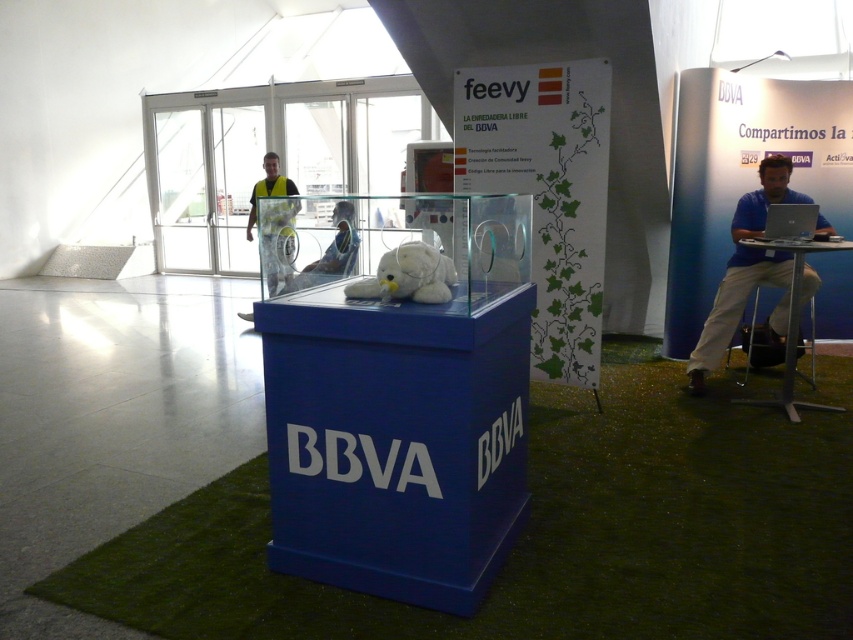
You are organizing a booth at an event and need to place a name tag on the blue cotton shirt at right and the yellow reflective vest at center. If the name tags are the same size, which item will have more space left after attaching the tag?

The blue cotton shirt at right has a larger width than the yellow reflective vest at center, so placing the same size name tag on both would leave more space on the blue cotton shirt at right.

In the scene shown: You are an event organizer checking the layout of the booth. You need to place a new sign that requires 1 meter of space. The yellow reflective vest at center and the white plush at center are currently occupying the central area. Can you estimate if there is enough space between them to accommodate the sign?

The yellow reflective vest at center might be wider than white plush at center, so there may not be enough space between them to fit a 1 meter sign. Check the actual width of both items first.

Based on the scene description, what object is located at the coordinates point (274, 224)?

The yellow reflective vest at center is located at point (274, 224).